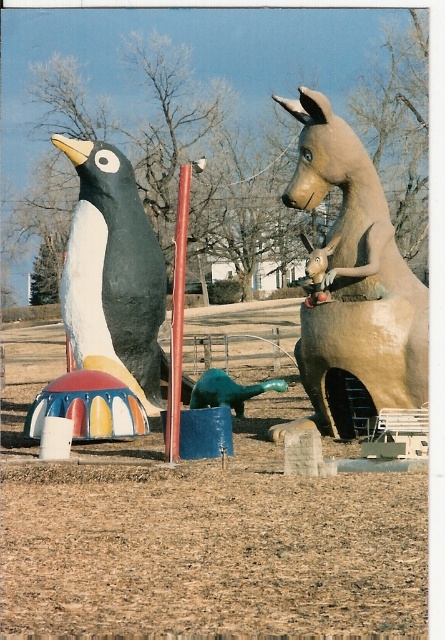
Does matte clay horse at upper right have a larger size compared to smooth red pole at center?

Yes, matte clay horse at upper right is bigger than smooth red pole at center.

Consider the image. Is matte clay horse at upper right behind smooth red pole at center?

Yes.

Which is in front, point (388, 273) or point (165, 435)?

Point (165, 435) is more forward.

Locate an element on the screen. Image resolution: width=445 pixels, height=640 pixels. matte clay horse at upper right is located at coordinates (354, 285).

Which of these two, matte black penguin at left or smooth red pole at center, stands shorter?

matte black penguin at left is shorter.

Find the location of `matte black penguin at left`. matte black penguin at left is located at coordinates (113, 273).

You are a GUI agent. You are given a task and a screenshot of the screen. Output one action in this format:
    pyautogui.click(x=<x>, y=<y>)
    Task: Click on the matte black penguin at left
    This screenshot has width=445, height=640.
    Given the screenshot: What is the action you would take?
    pyautogui.click(x=113, y=273)

The image size is (445, 640). In order to click on matte black penguin at left in this screenshot , I will do `click(113, 273)`.

Looking at this image, which of these two, matte clay horse at upper right or matte black penguin at left, stands shorter?

matte black penguin at left

Can you confirm if matte clay horse at upper right is positioned to the left of matte black penguin at left?

In fact, matte clay horse at upper right is to the right of matte black penguin at left.

You are a GUI agent. You are given a task and a screenshot of the screen. Output one action in this format:
    pyautogui.click(x=<x>, y=<y>)
    Task: Click on the matte clay horse at upper right
    This screenshot has height=640, width=445.
    Given the screenshot: What is the action you would take?
    pyautogui.click(x=354, y=285)